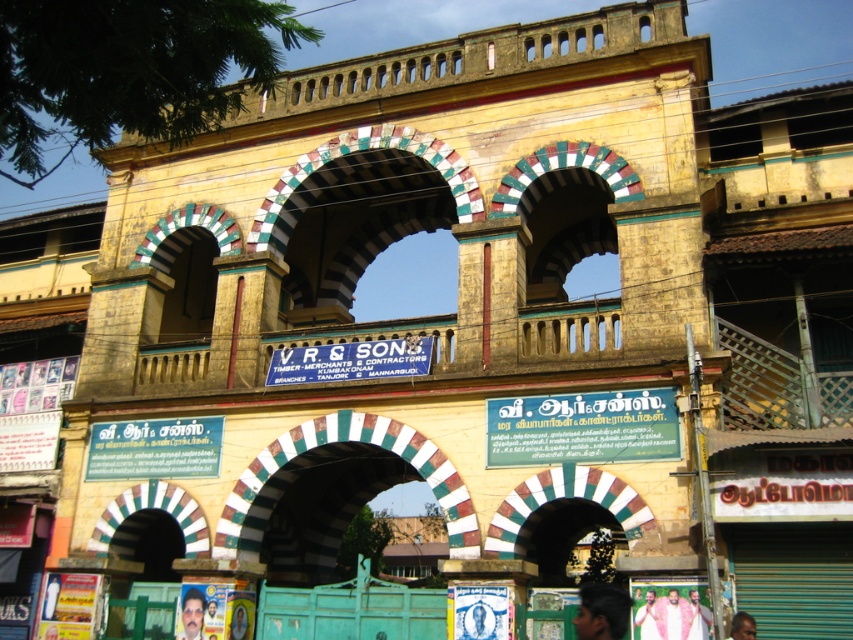
Who is higher up, light pink fabric at center or smooth skin face at center?

light pink fabric at center

Can you confirm if light pink fabric at center is smaller than smooth skin face at center?

No.

Describe the element at coordinates (672, 616) in the screenshot. I see `light pink fabric at center` at that location.

I want to click on light pink fabric at center, so click(672, 616).

Is light brown wooden person at center to the right of dark skin human head at center from the viewer's perspective?

In fact, light brown wooden person at center is to the left of dark skin human head at center.

Does point (653, 593) lie behind point (740, 636)?

Yes, point (653, 593) is behind point (740, 636).

Between point (645, 602) and point (752, 636), which one is positioned behind?

Positioned behind is point (645, 602).

What are the coordinates of `light brown wooden person at center` in the screenshot? It's located at (647, 618).

Is white painted stone archway at center to the right of light brown wooden frame at center from the viewer's perspective?

Yes, white painted stone archway at center is to the right of light brown wooden frame at center.

Does white painted stone archway at center appear under light brown wooden frame at center?

Incorrect, white painted stone archway at center is not positioned below light brown wooden frame at center.

Locate an element on the screen. Image resolution: width=853 pixels, height=640 pixels. white painted stone archway at center is located at coordinates (332, 492).